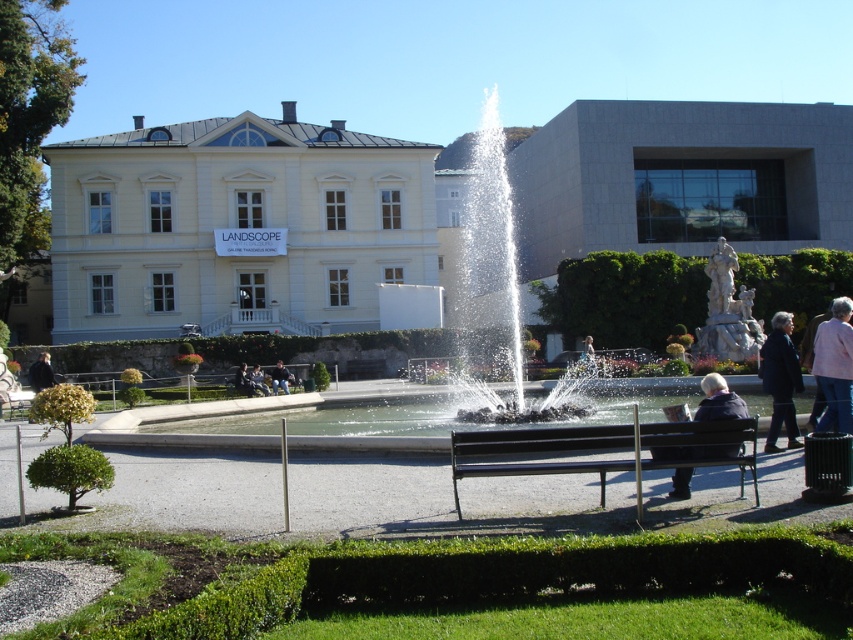
Question: Which point is closer to the camera taking this photo?

Choices:
 (A) (38, 364)
 (B) (695, 618)
 (C) (280, 368)

Answer: (B)

Question: Can you confirm if black metal bench at center is wider than light brown leather jacket at center?

Choices:
 (A) no
 (B) yes

Answer: (B)

Question: Which point is farther from the camera taking this photo?

Choices:
 (A) (32, 380)
 (B) (109, 182)
 (C) (670, 452)
 (D) (755, 518)

Answer: (B)

Question: Estimate the real-world distances between objects in this image. Which object is farther from the light brown leather jacket at center?

Choices:
 (A) smooth stone bench at center
 (B) clear glass water at center

Answer: (B)

Question: Is smooth stone bench at center below light brown leather jacket at center?

Choices:
 (A) no
 (B) yes

Answer: (A)

Question: Is dark blue coat at lower right to the left of dark blue jacket at center from the viewer's perspective?

Choices:
 (A) no
 (B) yes

Answer: (A)